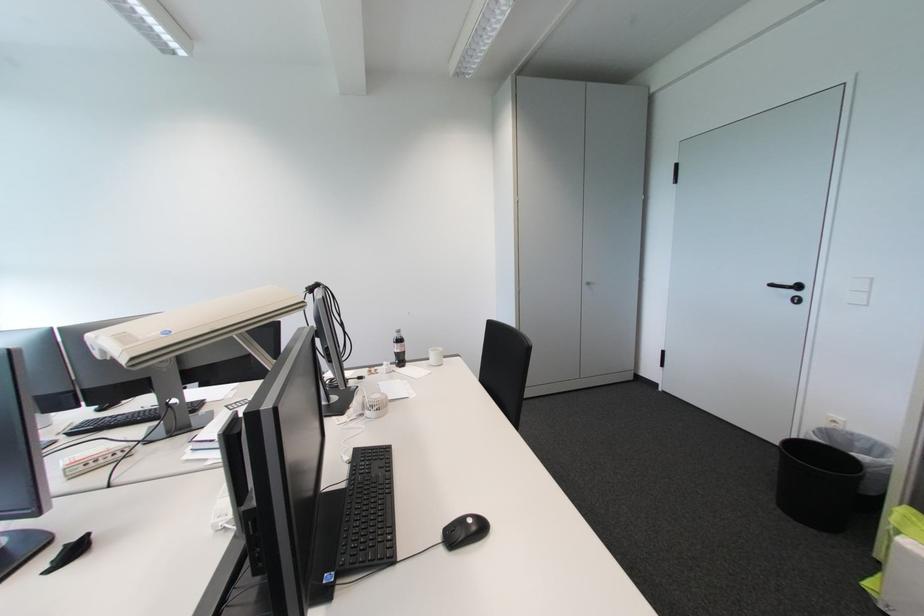
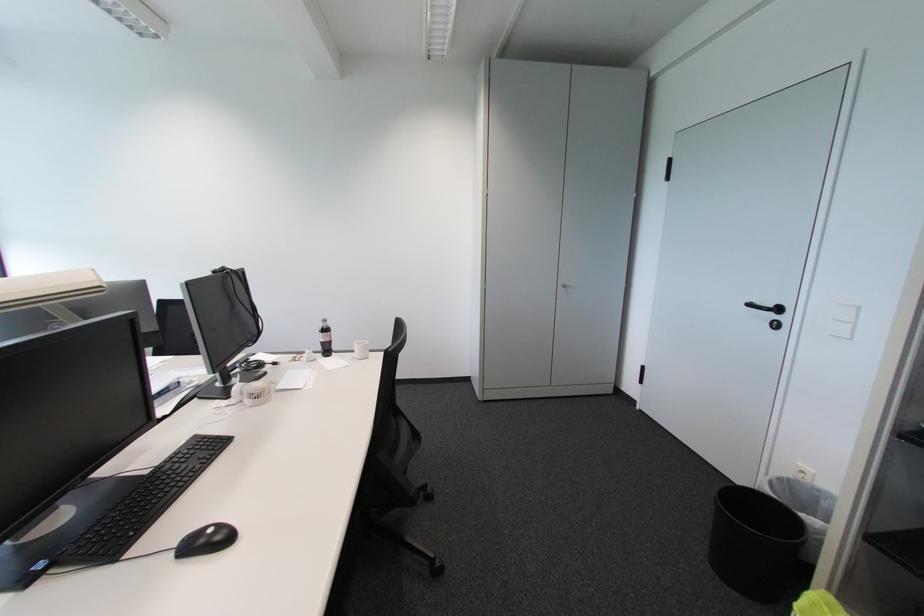
Find the pixel in the second image that matches point (361, 451) in the first image.

(202, 438)